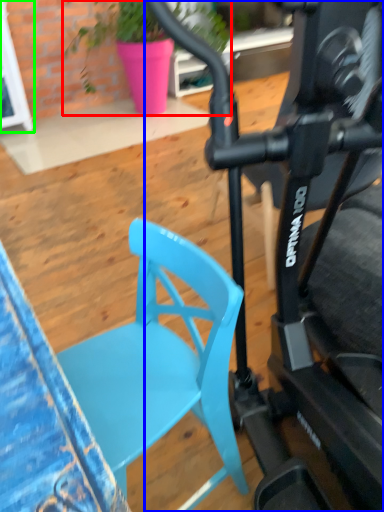
Question: Which object is the closest to the houseplant (highlighted by a red box)? Choose among these: bicycle (highlighted by a blue box) or glass door (highlighted by a green box).

Choices:
 (A) bicycle
 (B) glass door

Answer: (B)